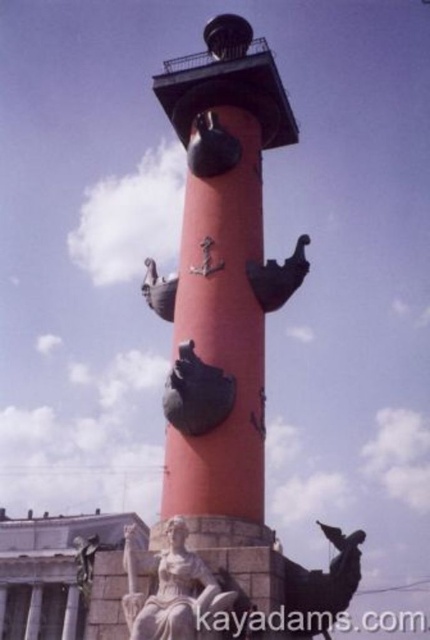
Question: From the image, what is the correct spatial relationship of smooth red tower at center in relation to white marble statue at center?

Choices:
 (A) left
 (B) right

Answer: (B)

Question: Observing the image, what is the correct spatial positioning of white marble statue at center in reference to shiny bronze bird at center?

Choices:
 (A) above
 (B) below

Answer: (B)

Question: Estimate the real-world distances between objects in this image. Which object is farther from the white marble statue at center?

Choices:
 (A) bronze statue at lower right
 (B) smooth red tower at center

Answer: (B)

Question: Can you confirm if bronze statue at lower right is thinner than shiny bronze bird at center?

Choices:
 (A) yes
 (B) no

Answer: (B)

Question: Among these objects, which one is nearest to the camera?

Choices:
 (A) bronze statue at lower right
 (B) white marble statue at center
 (C) shiny bronze bird at center
 (D) smooth red tower at center

Answer: (B)

Question: Which point is farther from the camera taking this photo?

Choices:
 (A) (x=322, y=628)
 (B) (x=226, y=144)
 (C) (x=153, y=564)

Answer: (B)